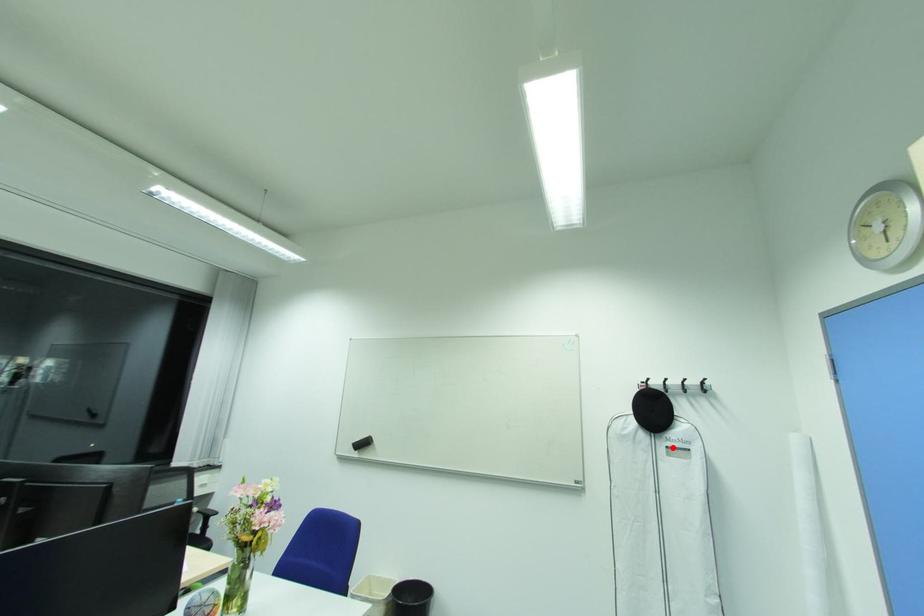
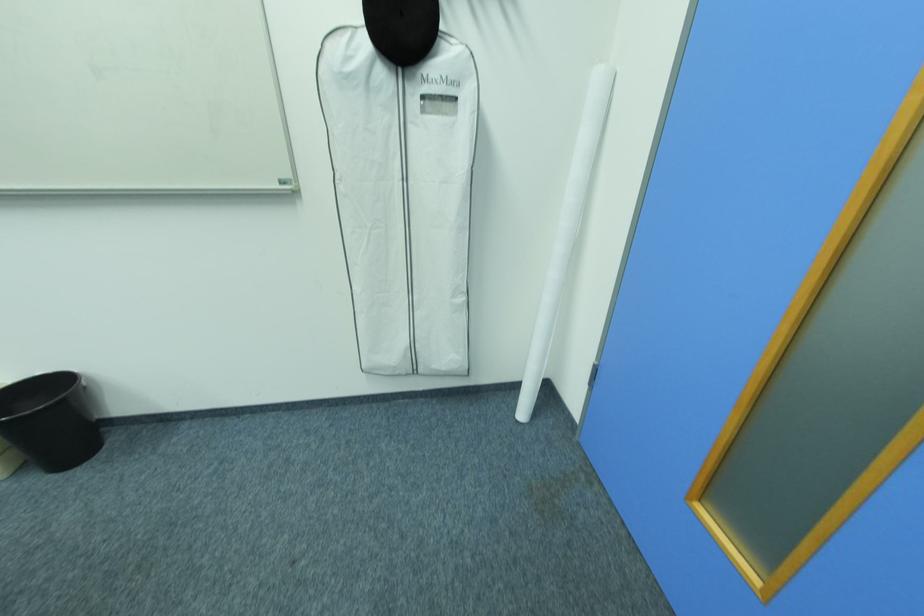
Where in the second image is the point corresponding to the highlighted location from the first image?

(428, 98)